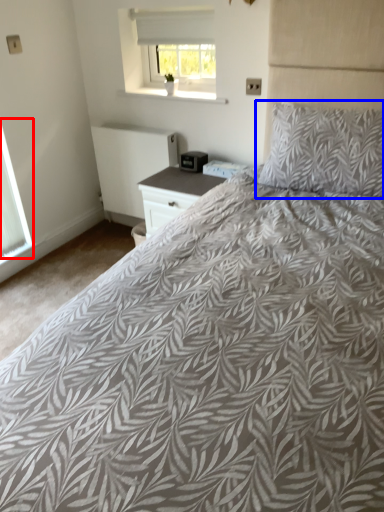
Question: Among these objects, which one is nearest to the camera, window (highlighted by a red box) or pillow (highlighted by a blue box)?

Choices:
 (A) window
 (B) pillow

Answer: (B)